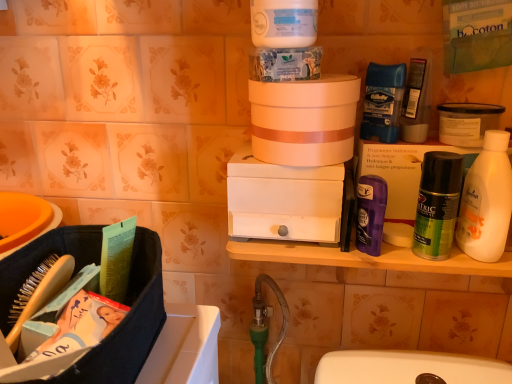
Question: In terms of width, does matte white box at right, which is the 2th box from left to right, look wider or thinner when compared to purple matte deodorant at right, marked as the second toiletry in a back-to-front arrangement?

Choices:
 (A) wide
 (B) thin

Answer: (A)

Question: Considering the positions of matte white box at right, which is the 2th box from left to right, and purple matte deodorant at right, the first toiletry from the bottom, in the image, is matte white box at right, which is the 2th box from left to right, taller or shorter than purple matte deodorant at right, the first toiletry from the bottom,?

Choices:
 (A) short
 (B) tall

Answer: (B)

Question: Which of these objects is positioned closest to the matte white box at right, the 1th box viewed from the right?

Choices:
 (A) white matte drawer at center, which is the 1th box from left to right
 (B) green matte mouthwash at right
 (C) blue paper towel at upper center, acting as the first product starting from the left
 (D) white plastic bottle at right
 (E) purple matte deodorant at right, marked as the second toiletry in a back-to-front arrangement

Answer: (B)

Question: Estimate the real-world distances between objects in this image. Which object is closer to the white matte jar at upper center?

Choices:
 (A) blue paper towel at upper center, the first product from the top
 (B) purple matte deodorant at right, the first toiletry from the bottom
 (C) matte white box at right, which is the 2th box from left to right
 (D) white plastic bottle at right
 (E) blue matte deodorant at upper right, the 1th toiletry positioned from the back

Answer: (A)